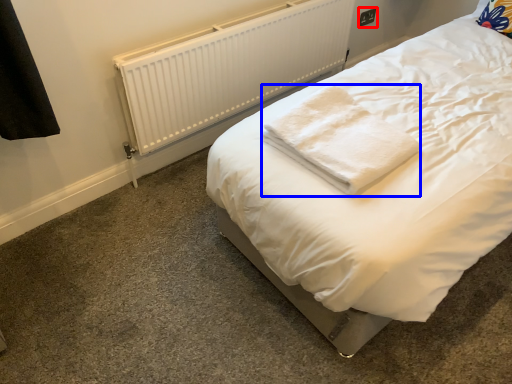
Question: Which point is further to the camera, electric outlet (highlighted by a red box) or cloth (highlighted by a blue box)?

Choices:
 (A) electric outlet
 (B) cloth

Answer: (A)